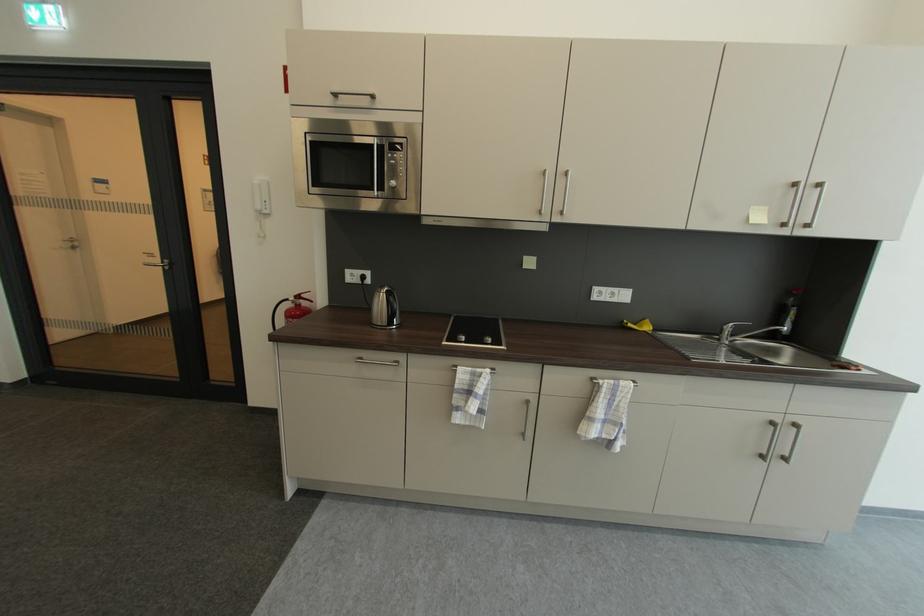
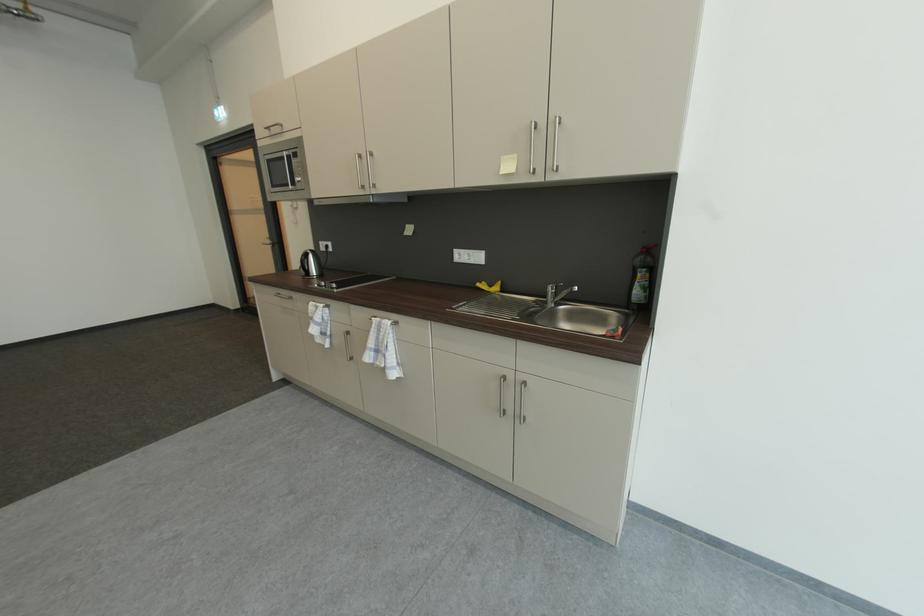
Find the pixel in the second image that matches (355,273) in the first image.

(327, 245)